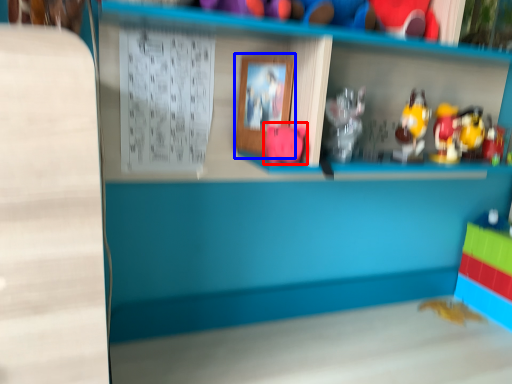
Question: Which object is further to the camera taking this photo, toy (highlighted by a red box) or picture frame (highlighted by a blue box)?

Choices:
 (A) toy
 (B) picture frame

Answer: (B)